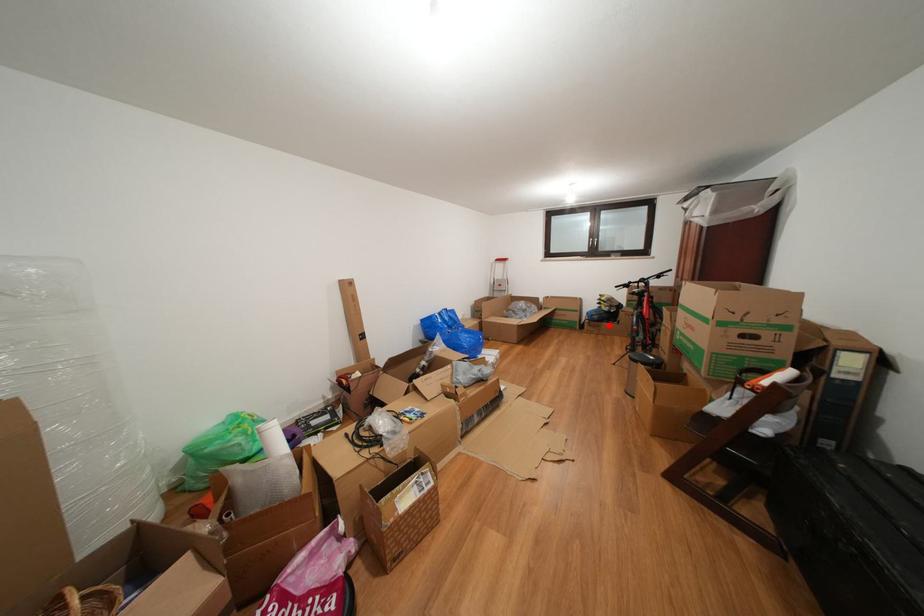
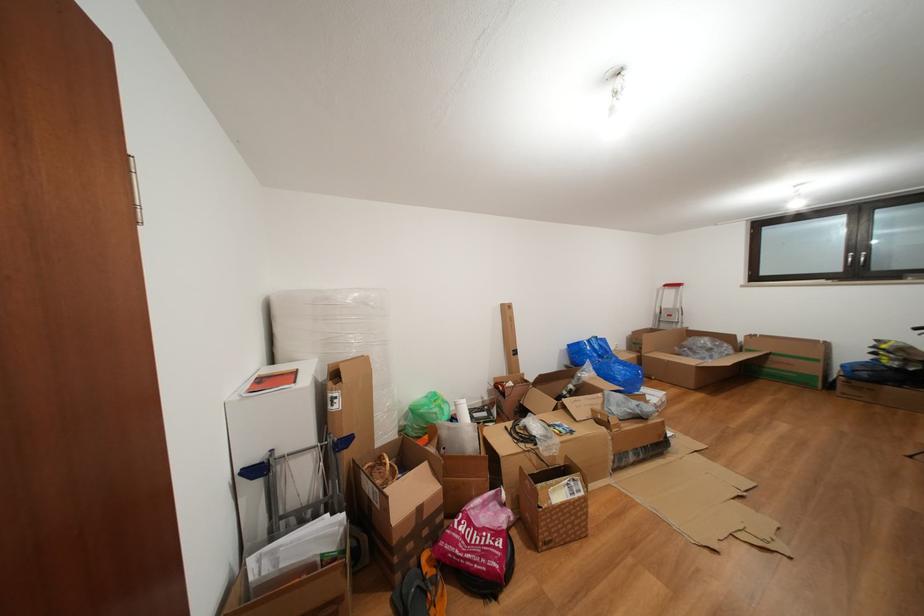
Question: I am providing you with two images of the same scene from different viewpoints. In image1, a red point is highlighted. Considering the same 3D point in image2, which of the following is correct?

Choices:
 (A) It is closer
 (B) It is farther

Answer: (B)